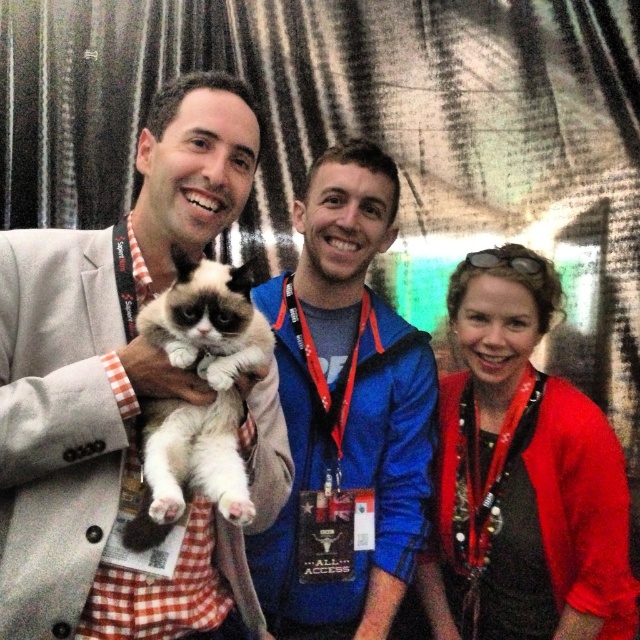
Can you confirm if light gray suit at center is bigger than blue fleece jacket at center?

Yes, light gray suit at center is bigger than blue fleece jacket at center.

Is light gray suit at center behind blue fleece jacket at center?

No.

Is point (116, 364) closer to viewer compared to point (358, 468)?

Yes.

Identify the location of light gray suit at center. (109, 384).

Is blue fleece jacket at center closer to the viewer compared to matte red cardigan at center?

That is False.

Does blue fleece jacket at center have a greater width compared to matte red cardigan at center?

No.

Is point (348, 524) positioned before point (600, 564)?

No.

Where is `blue fleece jacket at center`? blue fleece jacket at center is located at coordinates (346, 413).

Consider the image. Does light gray suit at center appear on the left side of white fluffy cat at center?

Indeed, light gray suit at center is positioned on the left side of white fluffy cat at center.

How far apart are light gray suit at center and white fluffy cat at center?

The distance of light gray suit at center from white fluffy cat at center is 4.48 inches.

Between point (113, 280) and point (252, 355), which one is positioned behind?

Positioned behind is point (113, 280).

Where is `light gray suit at center`? light gray suit at center is located at coordinates (109, 384).